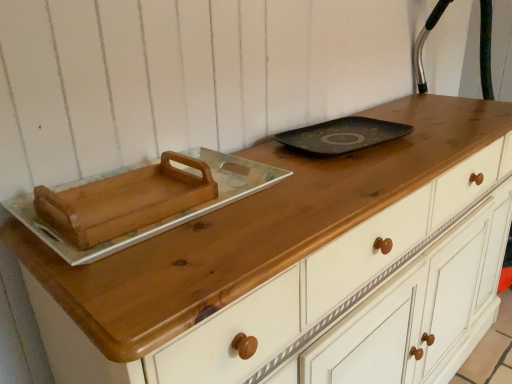
This screenshot has height=384, width=512. Identify the location of vacant space underneath black matte tray at center (from a real-world perspective). (336, 140).